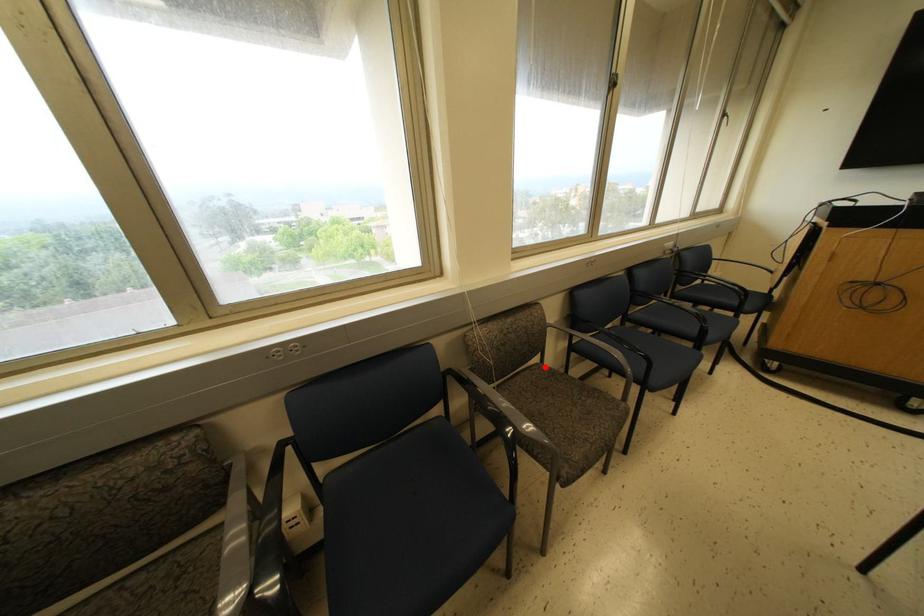
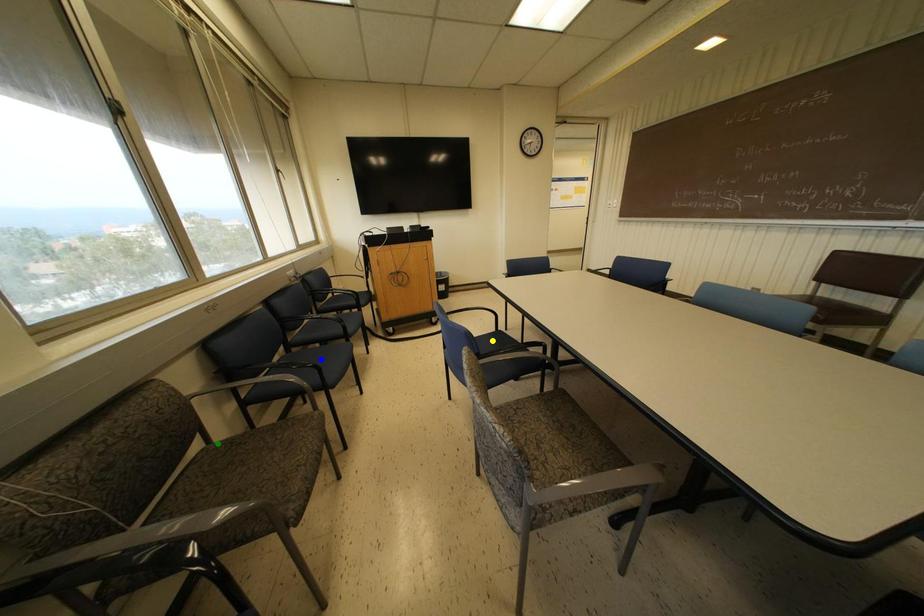
Question: I am providing you with two images of the same scene from different viewpoints. A red point is marked on the first image. You are given multiple points on the second image. Which spot in image 2 lines up with the point in image 1?

Choices:
 (A) blue point
 (B) green point
 (C) yellow point

Answer: (B)